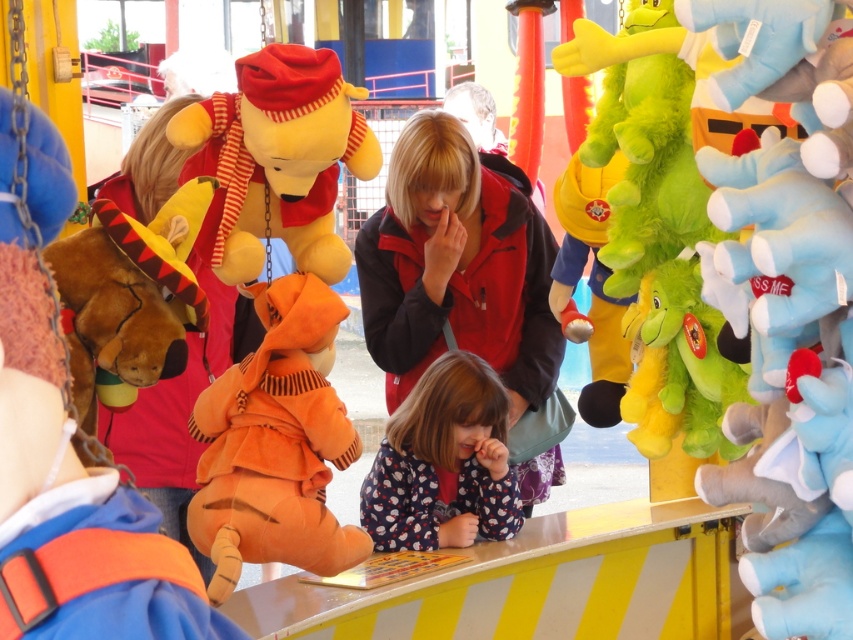
Which of these two, fluffy red jacket at center or dotted fabric dress at center, stands shorter?

dotted fabric dress at center

Does point (397, 275) come in front of point (477, 500)?

That is False.

Who is more forward, [447,477] or [421,477]?

Point [421,477] is more forward.

Where is `fluffy red jacket at center`? fluffy red jacket at center is located at coordinates (457, 266).

Who is taller, orange plush tiger at center or dotted fabric dress at center?

orange plush tiger at center is taller.

Does point (223, 378) lie in front of point (434, 532)?

Yes, point (223, 378) is in front of point (434, 532).

Find the location of a particular element. This screenshot has width=853, height=640. orange plush tiger at center is located at coordinates (276, 444).

Where is `orange plush tiger at center`? The image size is (853, 640). orange plush tiger at center is located at coordinates (276, 444).

Which is more to the left, fluffy red jacket at center or green plush toy at right?

From the viewer's perspective, fluffy red jacket at center appears more on the left side.

The width and height of the screenshot is (853, 640). What do you see at coordinates (457, 266) in the screenshot?
I see `fluffy red jacket at center` at bounding box center [457, 266].

The height and width of the screenshot is (640, 853). Identify the location of fluffy red jacket at center. (457, 266).